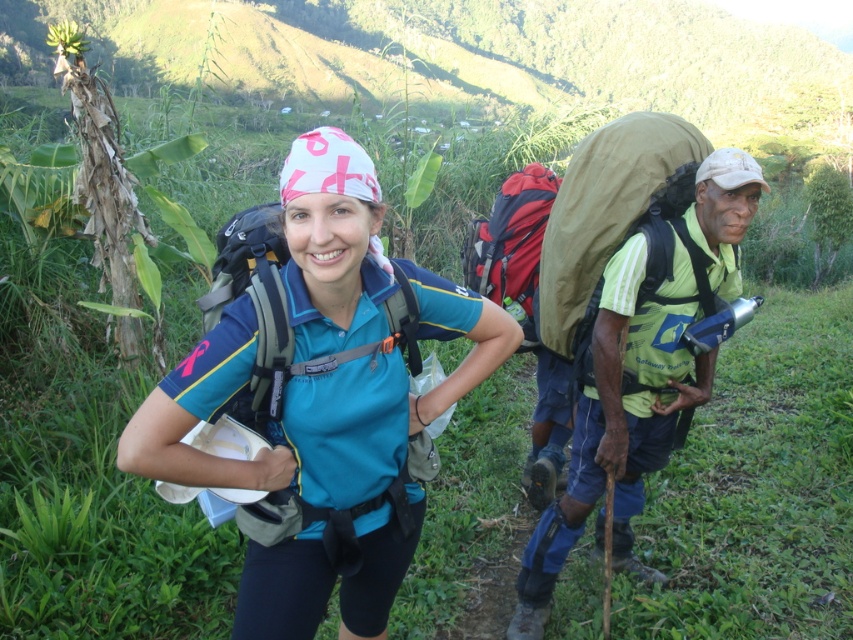
Does green fabric backpack at right have a lesser height compared to red matte backpack at center?

In fact, green fabric backpack at right may be taller than red matte backpack at center.

Does green fabric backpack at right have a smaller size compared to red matte backpack at center?

Actually, green fabric backpack at right might be larger than red matte backpack at center.

You are a GUI agent. You are given a task and a screenshot of the screen. Output one action in this format:
    pyautogui.click(x=<x>, y=<y>)
    Task: Click on the green fabric backpack at right
    The height and width of the screenshot is (640, 853).
    Given the screenshot: What is the action you would take?
    coord(643,371)

Who is more distant from viewer, (688,308) or (271,212)?

Positioned behind is point (688,308).

From the picture: Is green fabric backpack at right behind matte gray backpack at center?

Yes, green fabric backpack at right is behind matte gray backpack at center.

Locate an element on the screen. green fabric backpack at right is located at coordinates (643, 371).

Does matte blue shirt at center have a larger size compared to matte gray backpack at center?

Yes.

Can you confirm if matte blue shirt at center is smaller than matte gray backpack at center?

No, matte blue shirt at center is not smaller than matte gray backpack at center.

This screenshot has width=853, height=640. Describe the element at coordinates (323, 401) in the screenshot. I see `matte blue shirt at center` at that location.

Locate an element on the screen. matte blue shirt at center is located at coordinates (323, 401).